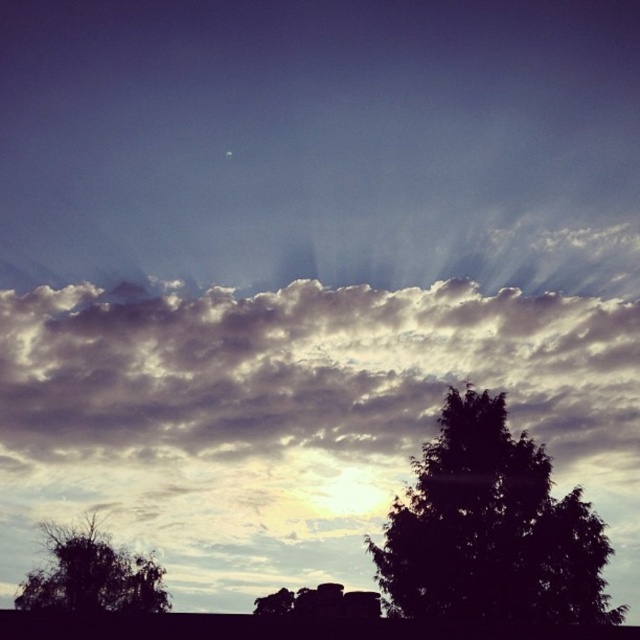
Can you confirm if cloudy sky at upper center is positioned above silhouette leafy tree at lower left?

Indeed, cloudy sky at upper center is positioned over silhouette leafy tree at lower left.

Is cloudy sky at upper center thinner than silhouette leafy tree at lower left?

Incorrect, cloudy sky at upper center's width is not less than silhouette leafy tree at lower left's.

Identify the location of cloudy sky at upper center. (305, 371).

I want to click on cloudy sky at upper center, so click(x=305, y=371).

Does cloudy sky at upper center appear under dark green leafy tree at lower right?

No.

Is cloudy sky at upper center to the right of dark green leafy tree at lower right from the viewer's perspective?

In fact, cloudy sky at upper center is to the left of dark green leafy tree at lower right.

Between point (10, 308) and point (554, 540), which one is positioned behind?

The point (10, 308) is more distant.

The height and width of the screenshot is (640, 640). What are the coordinates of `cloudy sky at upper center` in the screenshot? It's located at (305, 371).

Is dark green leafy tree at lower right bigger than silhouette leafy tree at lower left?

No.

Is point (502, 564) in front of point (84, 580)?

That is True.

Where is `dark green leafy tree at lower right`? The width and height of the screenshot is (640, 640). dark green leafy tree at lower right is located at coordinates (490, 529).